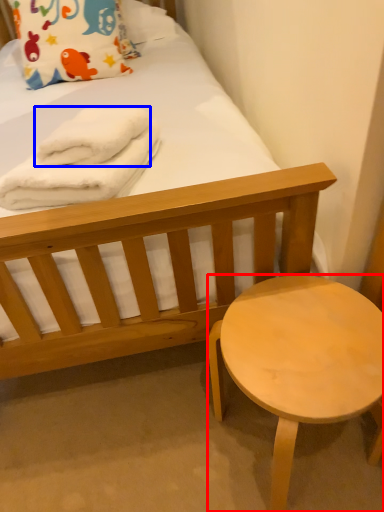
Question: Which object appears closest to the camera in this image, stool (highlighted by a red box) or bath towel (highlighted by a blue box)?

Choices:
 (A) stool
 (B) bath towel

Answer: (A)